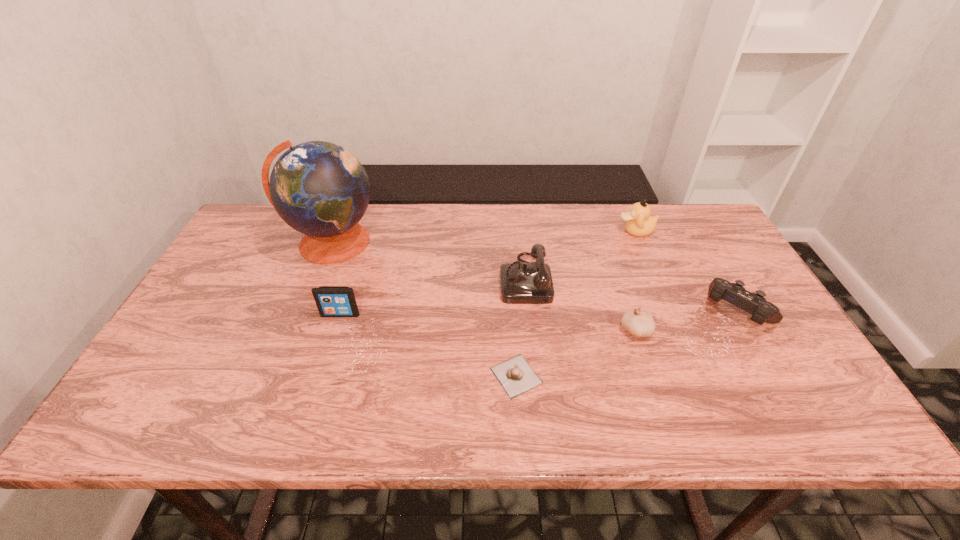
At what (x,y) coordinates should I click in order to perform the action: click on the tallest object. Please return your answer as a coordinate pair (x, y). Looking at the image, I should click on (320, 189).

At what (x,y) coordinates should I click in order to perform the action: click on duckling. Please return your answer as a coordinate pair (x, y). Looking at the image, I should click on click(639, 222).

The width and height of the screenshot is (960, 540). In order to click on telephone in this screenshot , I will do `click(521, 283)`.

Locate an element on the screen. The height and width of the screenshot is (540, 960). iPod is located at coordinates (332, 301).

Where is `control`? The image size is (960, 540). control is located at coordinates (754, 303).

Find the location of a particular element. This screenshot has height=540, width=960. the taller garlic is located at coordinates (640, 324).

At what (x,y) coordinates should I click in order to perform the action: click on the farther garlic. Please return your answer as a coordinate pair (x, y). The width and height of the screenshot is (960, 540). Looking at the image, I should click on (640, 324).

You are a GUI agent. You are given a task and a screenshot of the screen. Output one action in this format:
    pyautogui.click(x=<x>, y=<y>)
    Task: Click on the shortest object
    The image size is (960, 540).
    Given the screenshot: What is the action you would take?
    pyautogui.click(x=515, y=375)

The height and width of the screenshot is (540, 960). I want to click on the nearest object, so click(515, 375).

You are a GUI agent. You are given a task and a screenshot of the screen. Output one action in this format:
    pyautogui.click(x=<x>, y=<y>)
    Task: Click on the free space located with the Americas facing the viewer on the globe
    This screenshot has width=960, height=540.
    Given the screenshot: What is the action you would take?
    pyautogui.click(x=296, y=333)